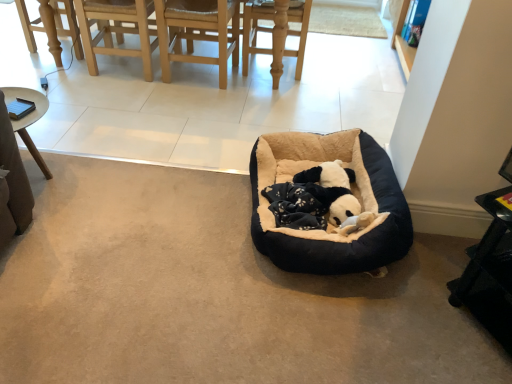
Question: Would you say black plush dog bed at center is to the left or to the right of light wood chair at upper left in the picture?

Choices:
 (A) left
 (B) right

Answer: (B)

Question: Is black plush dog bed at center wider or thinner than light wood chair at upper left?

Choices:
 (A) thin
 (B) wide

Answer: (B)

Question: Which is farther from the black plastic table at lower right?

Choices:
 (A) light wood chair at upper left
 (B) black plush dog bed at center

Answer: (A)

Question: Considering the real-world distances, which object is closest to the black plastic table at lower right?

Choices:
 (A) black plush dog bed at center
 (B) light wood chair at upper left

Answer: (A)